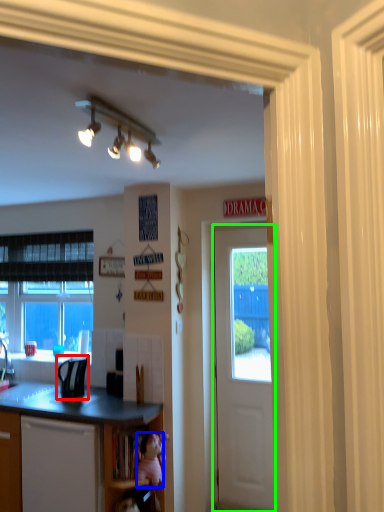
Question: Which object is the farthest from appliance (highlighted by a red box)? Choose among these: teddy bear (highlighted by a blue box) or door (highlighted by a green box).

Choices:
 (A) teddy bear
 (B) door

Answer: (B)